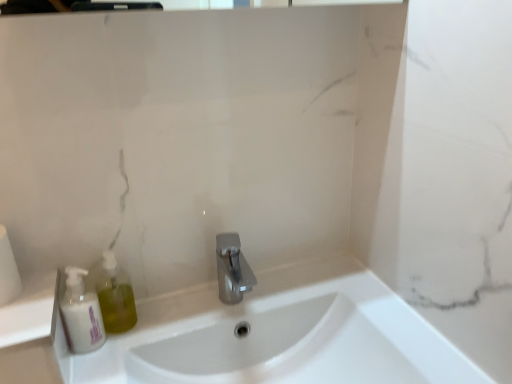
You are a GUI agent. You are given a task and a screenshot of the screen. Output one action in this format:
    pyautogui.click(x=<x>, y=<y>)
    Task: Click on the free space behind polished metallic faucet at center
    The height and width of the screenshot is (384, 512).
    Given the screenshot: What is the action you would take?
    pyautogui.click(x=249, y=282)